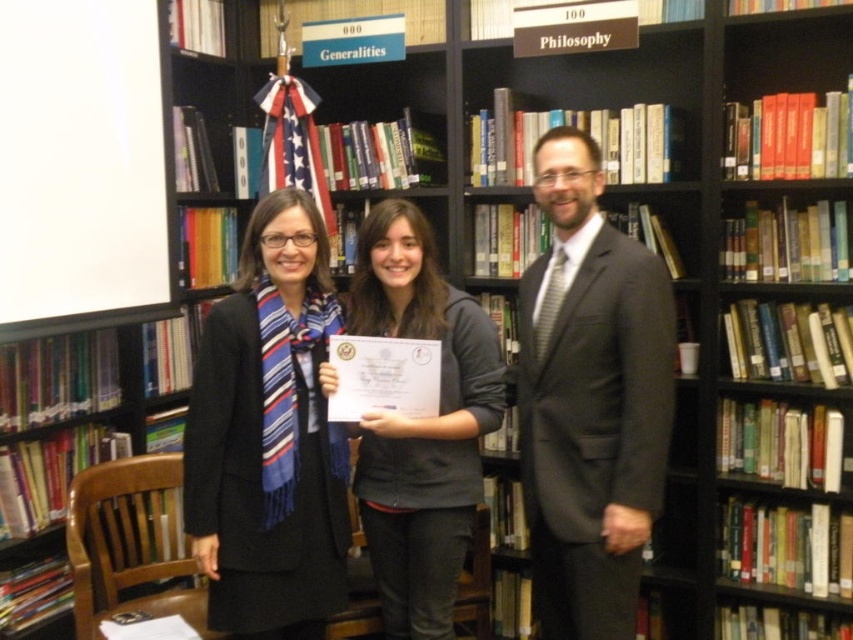
You are organizing a formal event and need to decide which gray attire to wear. You have the gray suit at center and the gray fabric jacket at center. Based on their positions in the image, which one is to the right?

The gray suit at center is positioned on the right side of the gray fabric jacket at center, so the gray suit at center is to the right.

You are standing in the library and want to place a new book on the shelf. The book needs to be placed at the point closer to you between point A at point (234,324) and point B at point (358,241). Which point should you choose?

You should choose point A at point (234,324) because it is closer to the viewer than point B at point (358,241).

You are a tailor trying to determine which coat to alter first. Given that the black wool coat at center and the gray fabric jacket at center are both in need of length adjustments, which one should you prioritize if you want to shorten the longer one first?

The gray fabric jacket at center is longer than the black wool coat at center, so you should prioritize shortening the gray fabric jacket at center first.